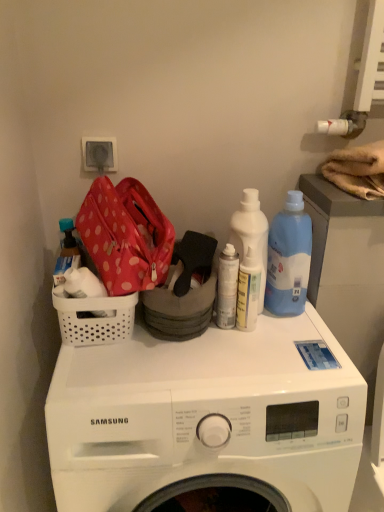
Question: From the image's perspective, does translucent plastic bottle at left, the second bottle when ordered from right to left, appear lower than white matte spray can at center, the 2th bottle viewed from the left?

Choices:
 (A) no
 (B) yes

Answer: (A)

Question: Could white matte spray can at center, the first bottle in the right-to-left sequence, be considered to be inside translucent plastic bottle at left, the 1th bottle positioned from the left?

Choices:
 (A) no
 (B) yes

Answer: (A)

Question: From a real-world perspective, is translucent plastic bottle at left, the second bottle when ordered from right to left, located higher than white matte spray can at center, the first bottle in the right-to-left sequence?

Choices:
 (A) yes
 (B) no

Answer: (A)

Question: Does translucent plastic bottle at left, the second bottle when ordered from right to left, have a lesser width compared to white matte spray can at center, the 2th bottle viewed from the left?

Choices:
 (A) no
 (B) yes

Answer: (A)

Question: Is translucent plastic bottle at left, the second bottle when ordered from right to left, not within white matte spray can at center, the 2th bottle viewed from the left?

Choices:
 (A) no
 (B) yes

Answer: (B)

Question: From the image's perspective, is translucent plastic bottle at left, the 1th bottle positioned from the left, on top of white matte spray can at center, the 2th bottle viewed from the left?

Choices:
 (A) yes
 (B) no

Answer: (A)

Question: Is translucent plastic spray bottle at center, which is counted as the third cleaning product, starting from the right, positioned beyond the bounds of white plastic bottle at center, the second cleaning product viewed from the left?

Choices:
 (A) yes
 (B) no

Answer: (A)

Question: From the image's perspective, is translucent plastic spray bottle at center, which is counted as the 1th cleaning product, starting from the left, above white plastic bottle at center, the second cleaning product viewed from the left?

Choices:
 (A) yes
 (B) no

Answer: (B)

Question: From a real-world perspective, is translucent plastic spray bottle at center, which is counted as the 1th cleaning product, starting from the left, positioned over white plastic bottle at center, acting as the 2th cleaning product starting from the right, based on gravity?

Choices:
 (A) no
 (B) yes

Answer: (A)

Question: Is translucent plastic spray bottle at center, which is counted as the 1th cleaning product, starting from the left, thinner than white plastic bottle at center, acting as the 2th cleaning product starting from the right?

Choices:
 (A) yes
 (B) no

Answer: (A)

Question: Does translucent plastic spray bottle at center, which is counted as the third cleaning product, starting from the right, lie in front of white plastic bottle at center, the second cleaning product viewed from the left?

Choices:
 (A) yes
 (B) no

Answer: (A)

Question: Is translucent plastic spray bottle at center, which is counted as the 1th cleaning product, starting from the left, taller than white plastic bottle at center, acting as the 2th cleaning product starting from the right?

Choices:
 (A) no
 (B) yes

Answer: (A)

Question: From a real-world perspective, is translucent plastic bottle at left, the 1th bottle positioned from the left, over translucent plastic spray bottle at center, which is counted as the 1th cleaning product, starting from the left?

Choices:
 (A) yes
 (B) no

Answer: (A)